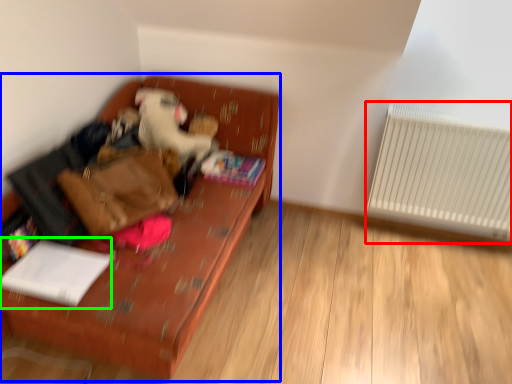
Question: Which object is positioned closest to radiator (highlighted by a red box)? Select from furniture (highlighted by a blue box) and book (highlighted by a green box).

Choices:
 (A) furniture
 (B) book

Answer: (A)